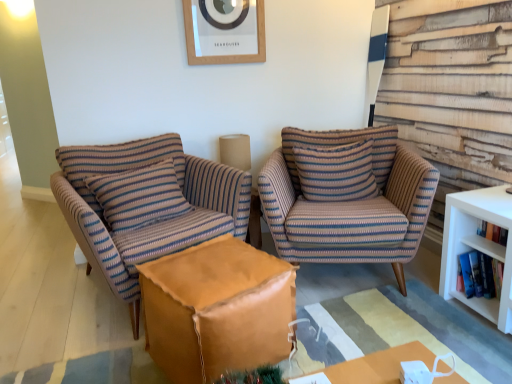
Question: Is striped fabric armchair at center, which is the second chair in left-to-right order, in contact with striped fabric pillow at center, the 1th pillow from the right?

Choices:
 (A) yes
 (B) no

Answer: (B)

Question: Can you confirm if striped fabric armchair at center, which appears as the first chair when viewed from the right, is wider than striped fabric pillow at center, the 1th pillow from the right?

Choices:
 (A) no
 (B) yes

Answer: (B)

Question: Is striped fabric armchair at center, which appears as the first chair when viewed from the right, bigger than striped fabric pillow at center, the 2th pillow in the left-to-right sequence?

Choices:
 (A) yes
 (B) no

Answer: (A)

Question: Can you confirm if striped fabric armchair at center, which is the second chair in left-to-right order, is positioned to the right of striped fabric pillow at center, the 1th pillow from the right?

Choices:
 (A) no
 (B) yes

Answer: (B)

Question: Does striped fabric armchair at center, which is the second chair in left-to-right order, contain striped fabric pillow at center, the 1th pillow from the right?

Choices:
 (A) yes
 (B) no

Answer: (A)

Question: From a real-world perspective, is white paperbacks at right, positioned as the 1th book in bottom-to-top order, above or below striped fabric armchair at center, which appears as the first chair when viewed from the right?

Choices:
 (A) below
 (B) above

Answer: (A)

Question: In terms of height, does white paperbacks at right, positioned as the 1th book in bottom-to-top order, look taller or shorter compared to striped fabric armchair at center, which is the second chair in left-to-right order?

Choices:
 (A) tall
 (B) short

Answer: (B)

Question: In the image, is white paperbacks at right, positioned as the 1th book in bottom-to-top order, positioned in front of or behind striped fabric armchair at center, which appears as the first chair when viewed from the right?

Choices:
 (A) behind
 (B) front

Answer: (B)

Question: Is white paperbacks at right, positioned as the 1th book in bottom-to-top order, situated inside striped fabric armchair at center, which is the second chair in left-to-right order, or outside?

Choices:
 (A) outside
 (B) inside

Answer: (A)

Question: From the image's perspective, relative to striped fabric armchair at center, which appears as the first chair when viewed from the right, is wooden picture frame at upper center above or below?

Choices:
 (A) below
 (B) above

Answer: (B)

Question: In terms of height, does wooden picture frame at upper center look taller or shorter compared to striped fabric armchair at center, which is the second chair in left-to-right order?

Choices:
 (A) tall
 (B) short

Answer: (B)

Question: Considering the positions of wooden picture frame at upper center and striped fabric armchair at center, which appears as the first chair when viewed from the right, in the image, is wooden picture frame at upper center bigger or smaller than striped fabric armchair at center, which appears as the first chair when viewed from the right,?

Choices:
 (A) big
 (B) small

Answer: (B)

Question: Would you say wooden picture frame at upper center is inside or outside striped fabric armchair at center, which is the second chair in left-to-right order?

Choices:
 (A) inside
 (B) outside

Answer: (B)

Question: Considering the relative positions of leather ottoman at center and striped fabric pillow at center, the 1th pillow from the right, in the image provided, is leather ottoman at center to the left or to the right of striped fabric pillow at center, the 1th pillow from the right,?

Choices:
 (A) right
 (B) left

Answer: (B)

Question: From the image's perspective, is leather ottoman at center above or below striped fabric pillow at center, the 2th pillow in the left-to-right sequence?

Choices:
 (A) below
 (B) above

Answer: (A)